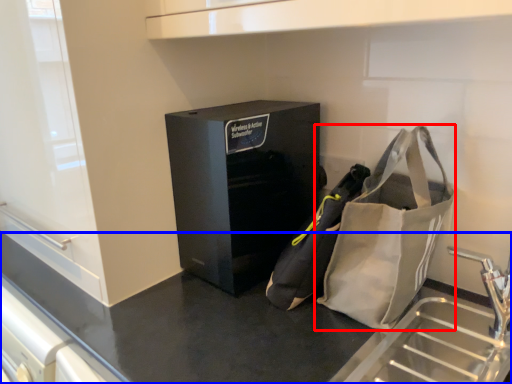
Question: Which object appears farthest to the camera in this image, handbag (highlighted by a red box) or counter (highlighted by a blue box)?

Choices:
 (A) handbag
 (B) counter

Answer: (A)